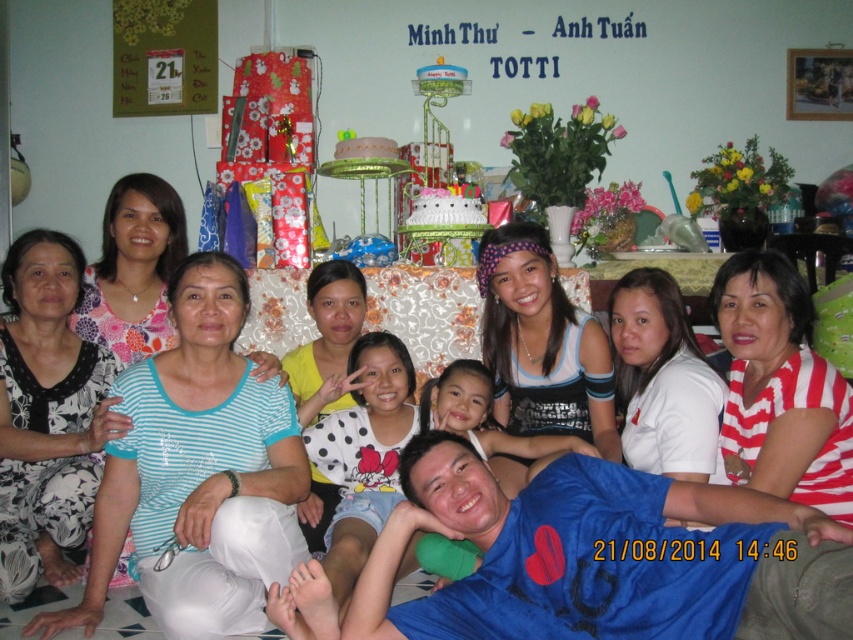
Question: Is white striped shirt at right behind white matte shirt at center?

Choices:
 (A) no
 (B) yes

Answer: (A)

Question: Can you confirm if blue cotton shirt at center is wider than yellow matte shirt at center?

Choices:
 (A) yes
 (B) no

Answer: (A)

Question: Which of these objects is positioned farthest from the white striped shirt at center?

Choices:
 (A) white jersey at center
 (B) floral fabric blouse at center
 (C) blue cotton shirt at lower center

Answer: (A)

Question: Among these objects, which one is farthest from the camera?

Choices:
 (A) blue cotton shirt at center
 (B) black printed dress at left
 (C) white jersey at center
 (D) yellow matte shirt at center

Answer: (D)

Question: Which point is farther to the camera?

Choices:
 (A) (627, 348)
 (B) (83, 605)

Answer: (A)

Question: Is black printed dress at left positioned before white matte shirt at center?

Choices:
 (A) no
 (B) yes

Answer: (B)